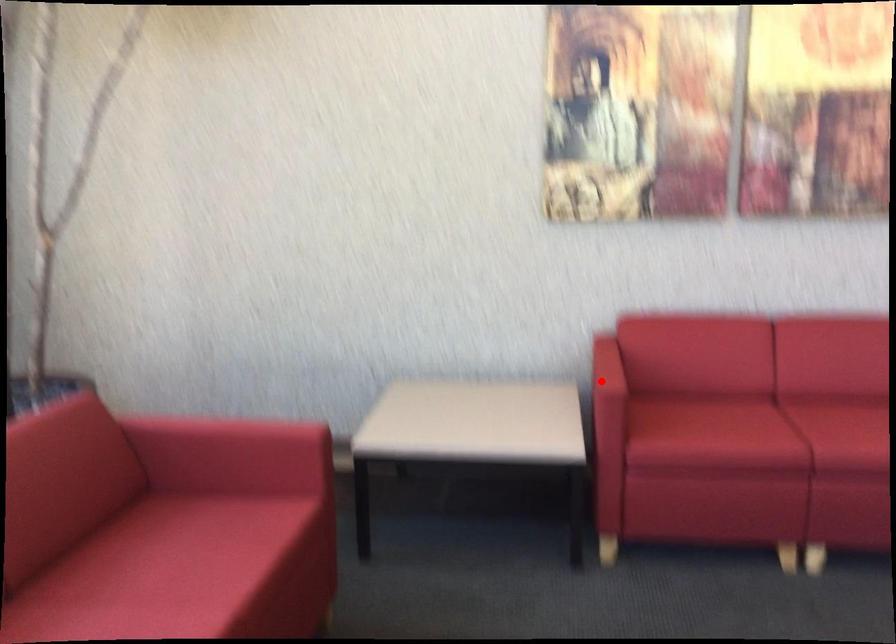
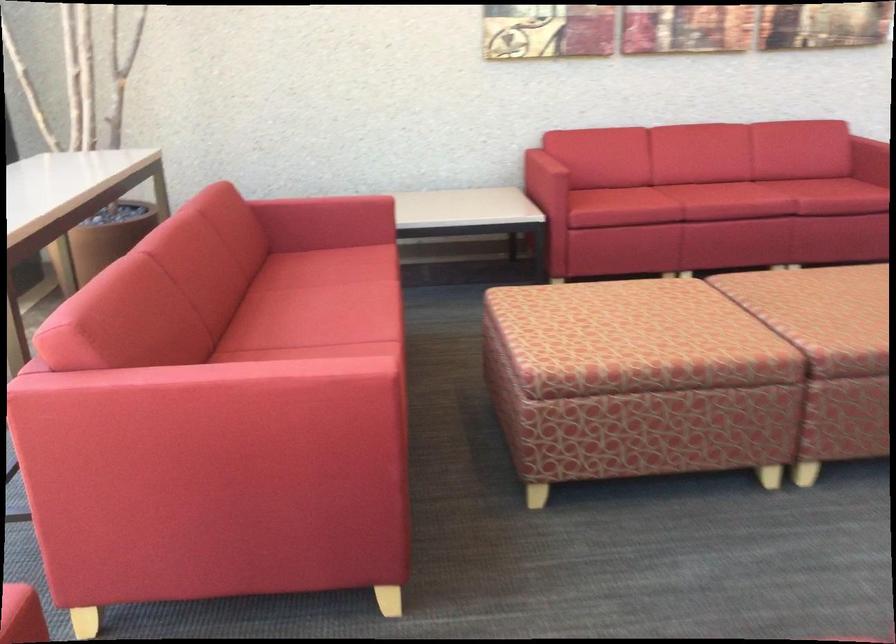
The point at the highlighted location is marked in the first image. Where is the corresponding point in the second image?

(545, 166)